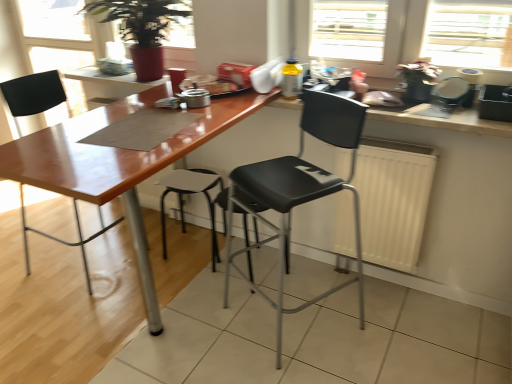
Find the location of a particular element. free space to the right of black plastic chair at center, placed as the 1th chair when sorted from right to left is located at coordinates (383, 326).